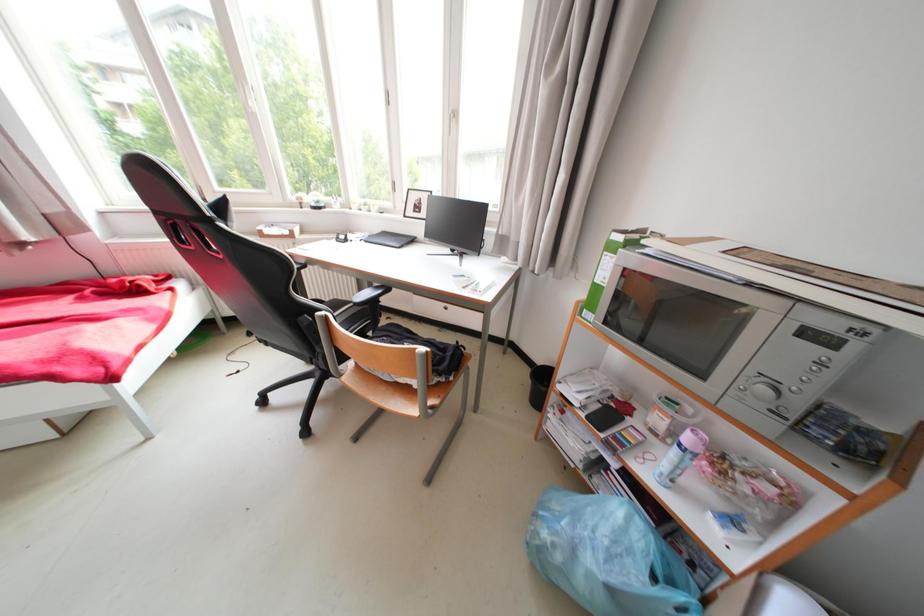
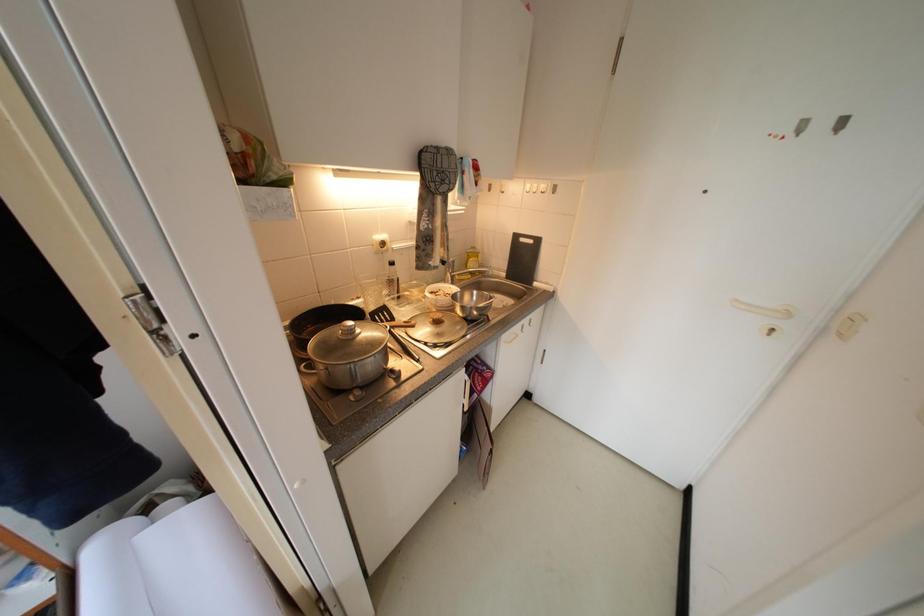
The first image is from the beginning of the video and the second image is from the end. How did the camera likely rotate when shooting the video?

The rotation direction of the camera is right-down.